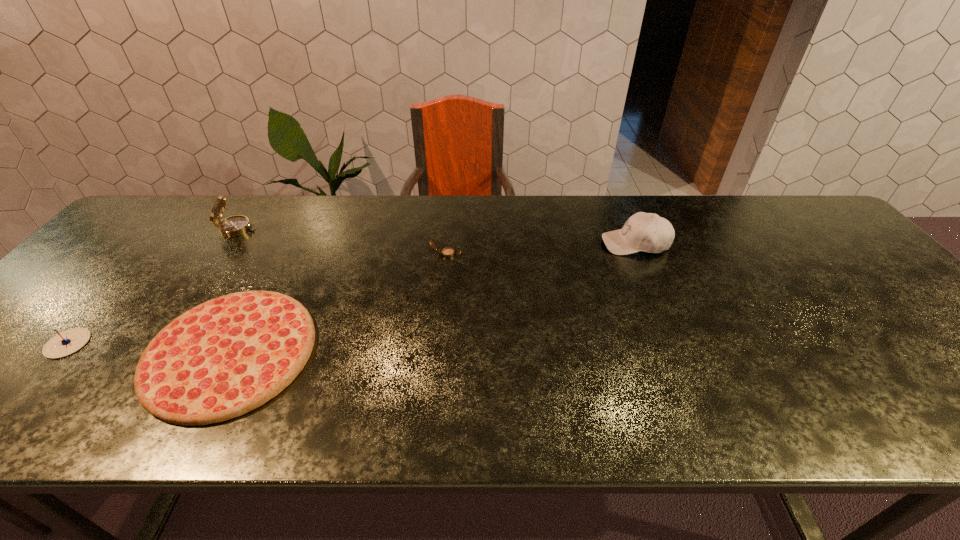
Locate an element on the screen. The height and width of the screenshot is (540, 960). free space located on the front-facing side of the baseball cap is located at coordinates (480, 244).

The width and height of the screenshot is (960, 540). I want to click on vacant area situated 0.080m on the front-facing side of the baseball cap, so click(574, 244).

Locate an element on the screen. free region located 0.050m on the left of the leftmost object is located at coordinates pyautogui.click(x=26, y=343).

Find the location of a particular element. free space located 0.390m on the face of the fourth object from left to right is located at coordinates (601, 254).

Locate an element on the screen. free spot located on the back of the shortest object is located at coordinates (304, 212).

Identify the location of compass that is at the far edge. The image size is (960, 540). 237,225.

The height and width of the screenshot is (540, 960). Find the location of `baseball cap that is at the far edge`. baseball cap that is at the far edge is located at coordinates (648, 232).

This screenshot has width=960, height=540. What are the coordinates of `object located in the near edge section of the desktop` in the screenshot? It's located at (230, 355).

The width and height of the screenshot is (960, 540). What are the coordinates of `object that is at the left edge` in the screenshot? It's located at (67, 342).

Locate an element on the screen. vacant point at the far edge is located at coordinates (766, 237).